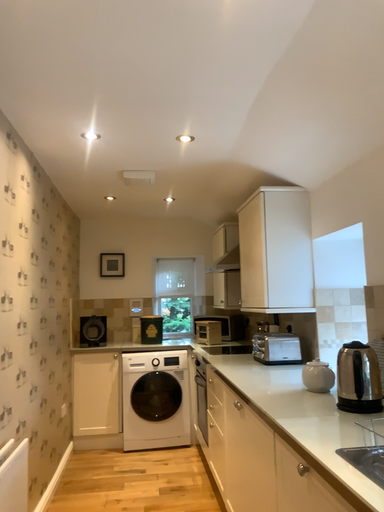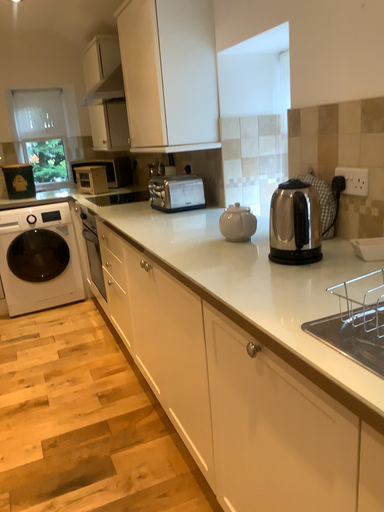
Question: Which way did the camera rotate in the video?

Choices:
 (A) rotated upward
 (B) rotated downward

Answer: (B)